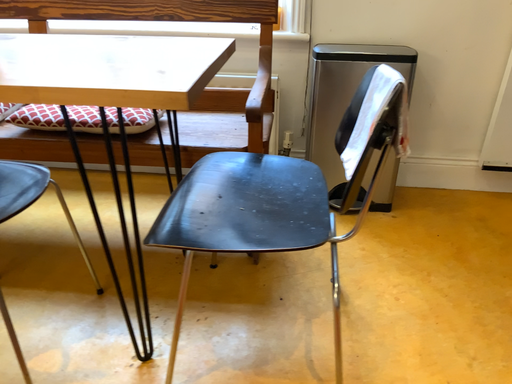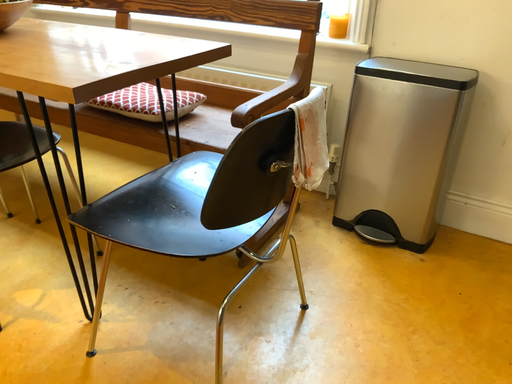
Question: Which way did the camera rotate in the video?

Choices:
 (A) rotated left
 (B) rotated right

Answer: (A)